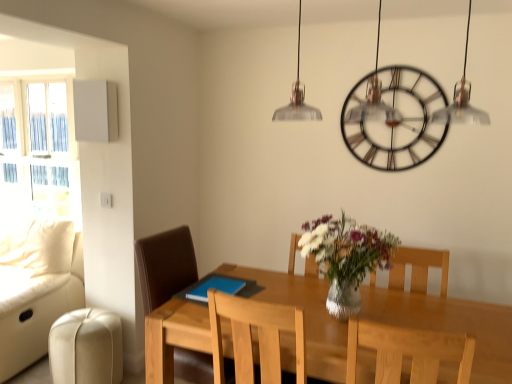
I want to click on light wood table at center, so click(x=450, y=325).

Describe the element at coordinates (39, 146) in the screenshot. I see `white glass window at left` at that location.

The width and height of the screenshot is (512, 384). Describe the element at coordinates (408, 352) in the screenshot. I see `light wood chair at center, the first chair viewed from the front` at that location.

The height and width of the screenshot is (384, 512). Describe the element at coordinates (347, 248) in the screenshot. I see `clear glass vase at center` at that location.

Looking at this image, what is the approximate height of metallic/brass-toned clock at upper center?

metallic/brass-toned clock at upper center is 28.32 inches tall.

This screenshot has height=384, width=512. Describe the element at coordinates (165, 266) in the screenshot. I see `brown leather chair at center, acting as the second chair starting from the front` at that location.

At what (x,y) coordinates should I click in order to perform the action: click on leather couch at left. Please return your answer as a coordinate pair (x, y). The width and height of the screenshot is (512, 384). Looking at the image, I should click on (39, 292).

From a real-world perspective, which is physically below, clear glass vase at center or light wood chair at center, the 1th chair viewed from the right?

In real-world perspective, light wood chair at center, the 1th chair viewed from the right, is lower.

Is clear glass vase at center placed right next to light wood chair at center, the 1th chair viewed from the right?

clear glass vase at center and light wood chair at center, the 1th chair viewed from the right, are clearly separated.

Is point (324, 272) closer or farther from the camera than point (392, 356)?

Point (324, 272) is farther from the camera than point (392, 356).

Is clear glass vase at center not within light wood chair at center, which is the second chair from back to front?

Yes.

Does brown leather chair at center, the second chair from the right, come in front of white glass window at left?

Yes, the depth of brown leather chair at center, the second chair from the right, is less than that of white glass window at left.

Can you confirm if brown leather chair at center, the second chair from the right, is smaller than white glass window at left?

Yes.

Considering the sizes of objects brown leather chair at center, which is the 1th chair in left-to-right order, and white glass window at left in the image provided, who is taller, brown leather chair at center, which is the 1th chair in left-to-right order, or white glass window at left?

Standing taller between the two is white glass window at left.

Considering the positions of point (163, 237) and point (65, 160), is point (163, 237) closer or farther from the camera than point (65, 160)?

Point (163, 237) is closer to the camera than point (65, 160).

Considering the relative positions of leather couch at left and light wood table at center in the image provided, is leather couch at left in front of light wood table at center?

No, it is not.

From a real-world perspective, is leather couch at left beneath light wood table at center?

No.

From the image's perspective, which is above, leather couch at left or light wood table at center?

leather couch at left is shown above in the image.

Is point (10, 317) in front of point (163, 341)?

No.

Is light wood chair at center, the first chair viewed from the front, facing away from white glass window at left?

No, light wood chair at center, the first chair viewed from the front, is not facing the opposite direction of white glass window at left.

From a real-world perspective, who is located lower, light wood chair at center, the 1th chair viewed from the right, or white glass window at left?

From a 3D spatial view, light wood chair at center, the 1th chair viewed from the right, is below.

Is light wood chair at center, the first chair viewed from the front, with white glass window at left?

No, light wood chair at center, the first chair viewed from the front, is not next to white glass window at left.

From the image's perspective, between clear glass vase at center and leather couch at left, who is located below?

leather couch at left.

Does clear glass vase at center have a greater height compared to leather couch at left?

In fact, clear glass vase at center may be shorter than leather couch at left.

Measure the distance from clear glass vase at center to leather couch at left.

clear glass vase at center and leather couch at left are 1.97 meters apart.

Which of these two, clear glass vase at center or leather couch at left, is thinner?

clear glass vase at center.

Are white glass window at left and light wood table at center beside each other?

white glass window at left and light wood table at center are not in contact.

From the image's perspective, relative to light wood table at center, is white glass window at left above or below?

From the image's perspective, white glass window at left appears above light wood table at center.

Considering the sizes of objects white glass window at left and light wood table at center in the image provided, who is thinner, white glass window at left or light wood table at center?

With smaller width is white glass window at left.

Which is closer to the camera, (77, 200) or (280, 284)?

The point (280, 284) is closer.

Is leather couch at left turned away from beige leather swivel chair at lower left?

That's not correct — leather couch at left is not looking away from beige leather swivel chair at lower left.

Which is more to the right, leather couch at left or beige leather swivel chair at lower left?

beige leather swivel chair at lower left is more to the right.

Locate an element on the screen. This screenshot has width=512, height=384. swivel chair below the leather couch at left (from a real-world perspective) is located at coordinates (86, 347).

Are leather couch at left and beige leather swivel chair at lower left beside each other?

No, leather couch at left is not beside beige leather swivel chair at lower left.

This screenshot has height=384, width=512. What are the coordinates of `floral arrangement to the left of light wood chair at center, the 2th chair viewed from the left` in the screenshot? It's located at (347, 248).

From the image's perspective, which chair is the 2nd one below the white glass window at left? Please provide its 2D coordinates.

[(165, 266)]

From the image, which object appears to be farther from brown leather chair at center, acting as the second chair starting from the front, light wood table at center or beige leather swivel chair at lower left?

Among the two, light wood table at center is located further to brown leather chair at center, acting as the second chair starting from the front.

From the picture: Which object lies nearer to the anchor point leather couch at left, light wood chair at center, which is the second chair from back to front, or white glass window at left?

white glass window at left.

From the image, which object appears to be farther from light wood chair at center, the first chair viewed from the front, clear glass vase at center or brown leather chair at center, acting as the 1th chair starting from the back?

brown leather chair at center, acting as the 1th chair starting from the back.

Considering their positions, is leather couch at left positioned closer to metallic/brass-toned clock at upper center than white glass window at left?

leather couch at left is closer to metallic/brass-toned clock at upper center.

Looking at the image, which one is located closer to light wood table at center, leather couch at left or white glass window at left?

Among the two, leather couch at left is located nearer to light wood table at center.

When comparing their distances from metallic/brass-toned clock at upper center, does brown leather chair at center, acting as the second chair starting from the front, or clear glass vase at center seem further?

Based on the image, brown leather chair at center, acting as the second chair starting from the front, appears to be further to metallic/brass-toned clock at upper center.

Considering their positions, is light wood chair at center, the 1th chair viewed from the right, positioned closer to clear glass vase at center than metallic/brass-toned clock at upper center?

light wood chair at center, the 1th chair viewed from the right, is closer to clear glass vase at center.

Estimate the real-world distances between objects in this image. Which object is closer to white glass window at left, metallic/brass-toned clock at upper center or light wood table at center?

Among the two, light wood table at center is located nearer to white glass window at left.

Where is `floral arrangement that lies between metallic/brass-toned clock at upper center and light wood table at center from top to bottom`? This screenshot has height=384, width=512. floral arrangement that lies between metallic/brass-toned clock at upper center and light wood table at center from top to bottom is located at coordinates (347, 248).

This screenshot has height=384, width=512. In order to click on chair located between leather couch at left and clear glass vase at center in the left-right direction in this screenshot , I will do `click(165, 266)`.

You are a GUI agent. You are given a task and a screenshot of the screen. Output one action in this format:
    pyautogui.click(x=<x>, y=<y>)
    Task: Click on the couch between white glass window at left and light wood table at center
    The image size is (512, 384).
    Given the screenshot: What is the action you would take?
    pyautogui.click(x=39, y=292)

Image resolution: width=512 pixels, height=384 pixels. Identify the location of swivel chair situated between leather couch at left and brown leather chair at center, acting as the 1th chair starting from the back, from left to right. (86, 347).